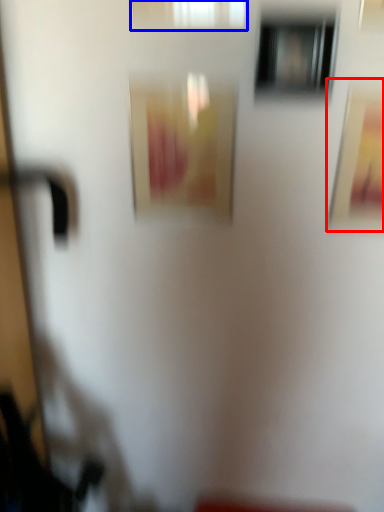
Question: Which object is further to the camera taking this photo, picture frame (highlighted by a red box) or window (highlighted by a blue box)?

Choices:
 (A) picture frame
 (B) window

Answer: (A)